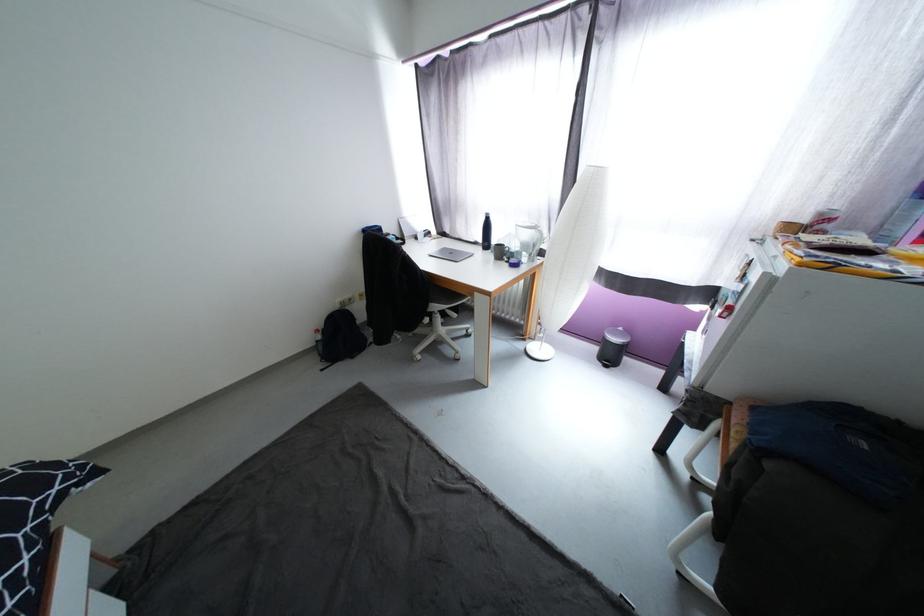
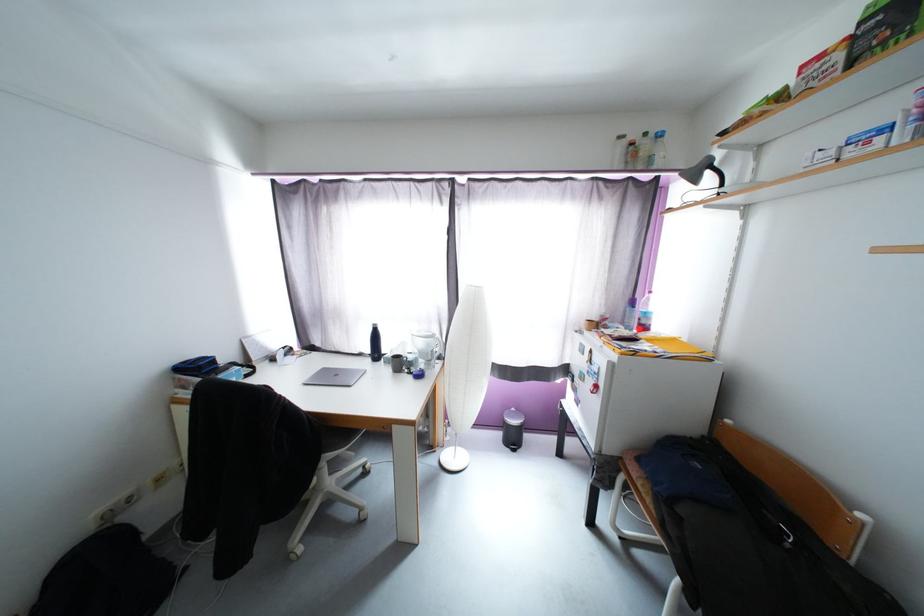
In the second image, find the point that corresponds to (x=601, y=350) in the first image.

(505, 437)